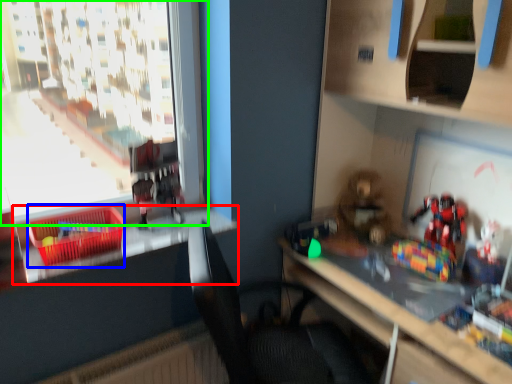
Question: Estimate the real-world distances between objects in this image. Which object is closer to window sill (highlighted by a red box), crate (highlighted by a blue box) or window (highlighted by a green box)?

Choices:
 (A) crate
 (B) window

Answer: (A)